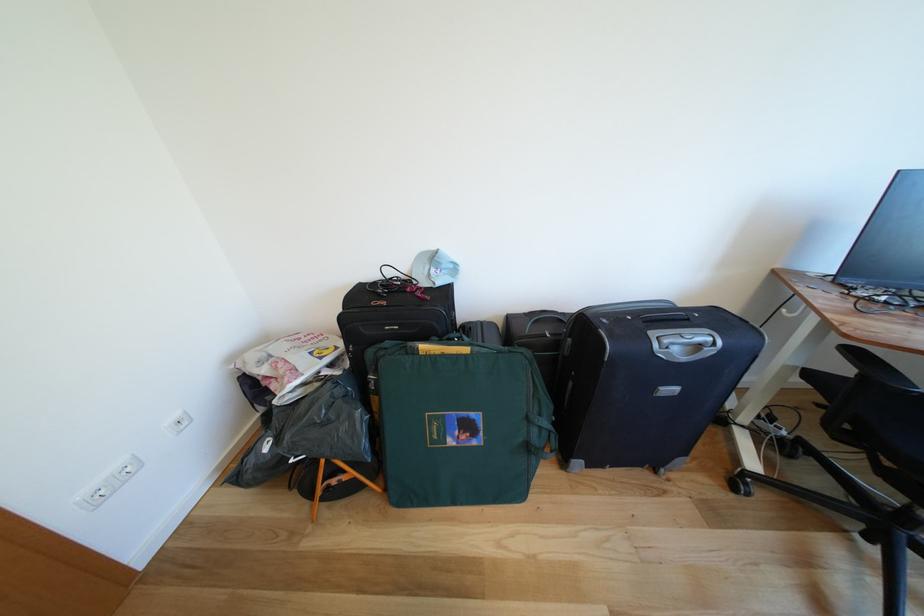
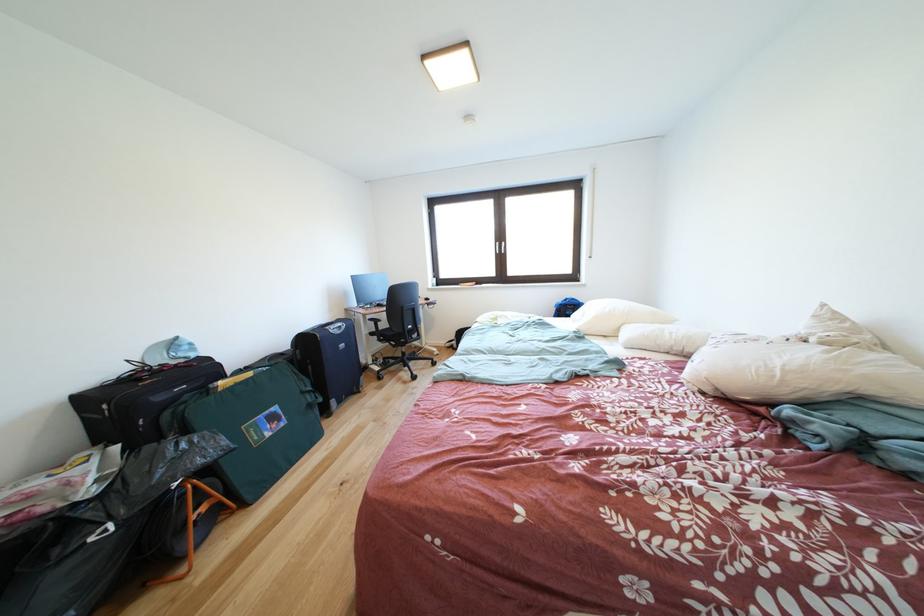
Find the pixel in the second image that matches point (893, 477) in the first image.

(403, 351)